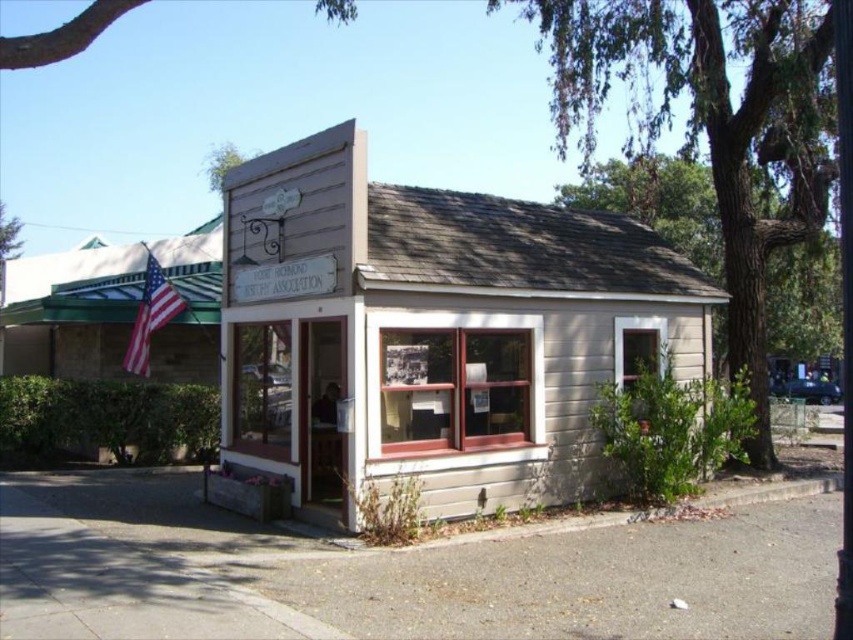
You are standing in front of the building and want to place a new plaque next to the wooden signboard at center. Which direction should you move relative to the matte american flag at left to position the plaque correctly?

You should move to the right of the matte american flag at left to position the plaque next to the wooden signboard at center, since the wooden signboard at center is located to the right of the matte american flag at left.

You are standing at the entrance of the building and want to place a new plaque between the wooden signboard at center and the matte american flag at left. If the plaque requires 2 meters of space, will there be enough room?

The wooden signboard at center is 4.79 meters away from the matte american flag at left, so placing a plaque requiring 2 meters of space between them would be possible as the distance is sufficient.

You are standing in front of the Fort Ross Historical Association building and need to determine the relative positions of two points marked on the building. Which point is closer to you, point (534, 481) or point (154, 273)?

Point (534, 481) is closer to the viewer than point (154, 273).